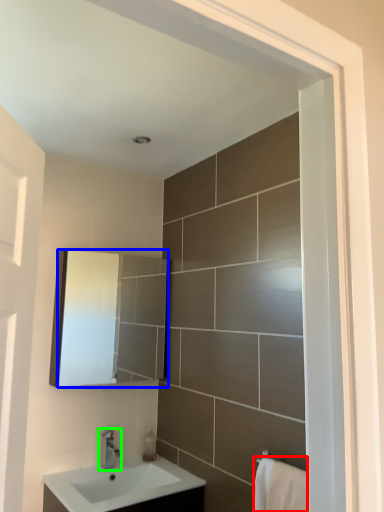
Question: Considering the real-world distances, which object is closest to bath towel (highlighted by a red box)? mirror (highlighted by a blue box) or tap (highlighted by a green box).

Choices:
 (A) mirror
 (B) tap

Answer: (B)